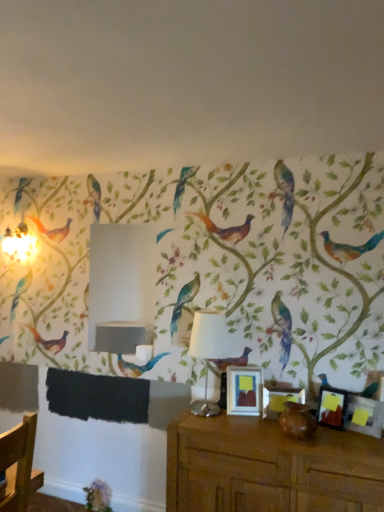
Question: Does brown matte vase at lower center have a greater height compared to matte black picture frame at right, placed as the third picture frame when sorted from left to right?

Choices:
 (A) yes
 (B) no

Answer: (B)

Question: From the image's perspective, is brown matte vase at lower center beneath matte black picture frame at right, which ranks as the 2th picture frame in right-to-left order?

Choices:
 (A) yes
 (B) no

Answer: (A)

Question: Is the surface of brown matte vase at lower center in direct contact with matte black picture frame at right, which ranks as the 2th picture frame in right-to-left order?

Choices:
 (A) no
 (B) yes

Answer: (A)

Question: Is brown matte vase at lower center to the right of matte black picture frame at right, placed as the third picture frame when sorted from left to right, from the viewer's perspective?

Choices:
 (A) yes
 (B) no

Answer: (B)

Question: Considering the relative positions of brown matte vase at lower center and matte black picture frame at right, which ranks as the 2th picture frame in right-to-left order, in the image provided, is brown matte vase at lower center to the left of matte black picture frame at right, which ranks as the 2th picture frame in right-to-left order, from the viewer's perspective?

Choices:
 (A) yes
 (B) no

Answer: (A)

Question: Relative to matte black picture frame at right, placed as the third picture frame when sorted from left to right, is matte silver picture frame at center, arranged as the 4th picture frame when viewed from the right, in front or behind?

Choices:
 (A) behind
 (B) front

Answer: (A)

Question: Is point (243, 411) positioned closer to the camera than point (339, 409)?

Choices:
 (A) closer
 (B) farther

Answer: (B)

Question: From the image's perspective, is matte silver picture frame at center, arranged as the 4th picture frame when viewed from the right, above or below matte black picture frame at right, placed as the third picture frame when sorted from left to right?

Choices:
 (A) below
 (B) above

Answer: (B)

Question: Is matte silver picture frame at center, which appears as the first picture frame when viewed from the left, taller or shorter than matte black picture frame at right, placed as the third picture frame when sorted from left to right?

Choices:
 (A) short
 (B) tall

Answer: (B)

Question: Is brown wooden table at lower right taller or shorter than white fabric lampshade at center?

Choices:
 (A) tall
 (B) short

Answer: (A)

Question: From a real-world perspective, is brown wooden table at lower right above or below white fabric lampshade at center?

Choices:
 (A) above
 (B) below

Answer: (B)

Question: Choose the correct answer: Is brown wooden table at lower right inside white fabric lampshade at center or outside it?

Choices:
 (A) inside
 (B) outside

Answer: (B)

Question: Looking at their shapes, would you say brown wooden table at lower right is wider or thinner than white fabric lampshade at center?

Choices:
 (A) thin
 (B) wide

Answer: (B)

Question: Based on their sizes in the image, would you say brown matte vase at lower center is bigger or smaller than matte black picture frame at lower right, the 1th picture frame from the right?

Choices:
 (A) small
 (B) big

Answer: (B)

Question: Is brown matte vase at lower center wider or thinner than matte black picture frame at lower right, the fourth picture frame in the left-to-right sequence?

Choices:
 (A) wide
 (B) thin

Answer: (A)